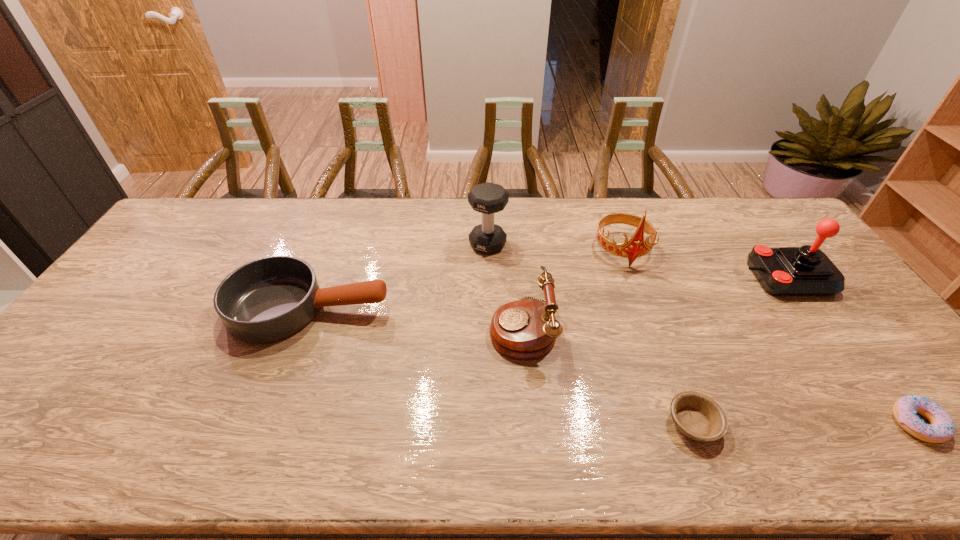
Identify the location of free location located on the base of the joystick. (722, 278).

You are a GUI agent. You are given a task and a screenshot of the screen. Output one action in this format:
    pyautogui.click(x=<x>, y=<y>)
    Task: Click on the vacant space located 0.290m on the base of the joystick
    The image size is (960, 540).
    Given the screenshot: What is the action you would take?
    pyautogui.click(x=650, y=278)

Find the location of `free space located 0.400m on the front of the dumbbell`. free space located 0.400m on the front of the dumbbell is located at coordinates (490, 358).

Identify the location of vacant area situated 0.160m on the dial of the fourth shortest object. This screenshot has height=540, width=960. (431, 327).

Find the location of a particular element. This screenshot has width=960, height=540. free location located on the dial of the fourth shortest object is located at coordinates (428, 327).

You are a GUI agent. You are given a task and a screenshot of the screen. Output one action in this format:
    pyautogui.click(x=<x>, y=<y>)
    Task: Click on the vacant space located 0.250m on the dial of the fourth shortest object
    The image size is (960, 540).
    Given the screenshot: What is the action you would take?
    pyautogui.click(x=399, y=327)

You are a GUI agent. You are given a task and a screenshot of the screen. Output one action in this format:
    pyautogui.click(x=<x>, y=<y>)
    Task: Click on the vacant area situated 0.300m on the handle side of the pan
    The image size is (960, 540).
    Given the screenshot: What is the action you would take?
    pyautogui.click(x=493, y=308)

You are a GUI agent. You are given a task and a screenshot of the screen. Output one action in this format:
    pyautogui.click(x=<x>, y=<y>)
    Task: Click on the vacant space located on the left of the doughnut
    
    Given the screenshot: What is the action you would take?
    pyautogui.click(x=796, y=423)

I want to click on free spot located on the back of the shortest object, so click(656, 323).

Locate an element on the screen. The height and width of the screenshot is (540, 960). tiara present at the far edge is located at coordinates (636, 247).